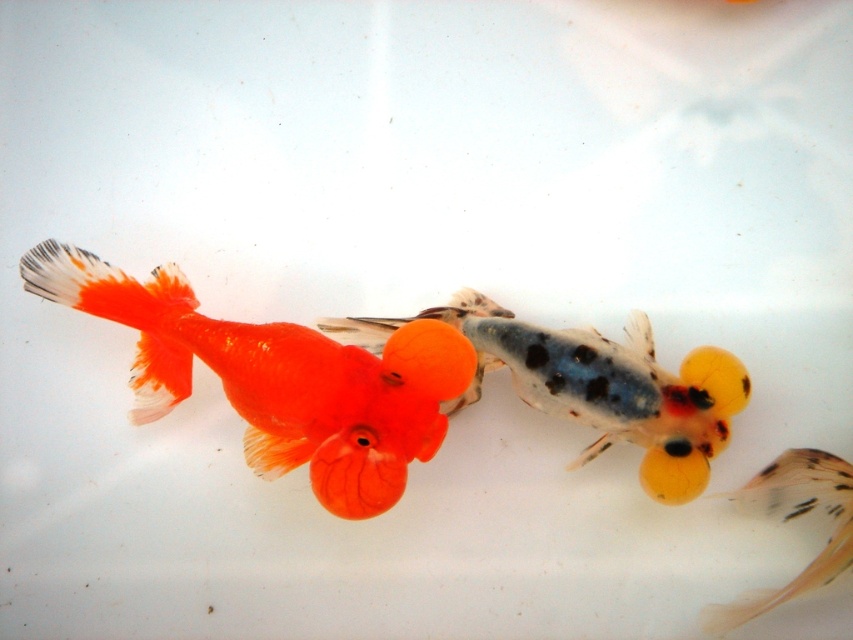
Between shiny orange goldfish at left and translucent orange goldfish at center, which one appears on the left side from the viewer's perspective?

From the viewer's perspective, shiny orange goldfish at left appears more on the left side.

Between shiny orange goldfish at left and translucent orange goldfish at center, which one appears on the right side from the viewer's perspective?

Positioned to the right is translucent orange goldfish at center.

Does point (160, 372) lie in front of point (549, 403)?

No.

Identify the location of shiny orange goldfish at left. (276, 378).

Who is positioned more to the left, shiny orange goldfish at left or translucent orange fish at lower right?

Positioned to the left is shiny orange goldfish at left.

Based on the photo, does shiny orange goldfish at left have a greater height compared to translucent orange fish at lower right?

Yes.

Describe the element at coordinates (276, 378) in the screenshot. I see `shiny orange goldfish at left` at that location.

At what (x,y) coordinates should I click in order to perform the action: click on shiny orange goldfish at left. Please return your answer as a coordinate pair (x, y). Looking at the image, I should click on (276, 378).

Is translucent orange goldfish at center further to the viewer compared to translucent orange fish at lower right?

Yes, translucent orange goldfish at center is behind translucent orange fish at lower right.

How distant is translucent orange goldfish at center from translucent orange fish at lower right?

translucent orange goldfish at center is 16.41 centimeters away from translucent orange fish at lower right.

This screenshot has width=853, height=640. What do you see at coordinates (595, 385) in the screenshot?
I see `translucent orange goldfish at center` at bounding box center [595, 385].

Image resolution: width=853 pixels, height=640 pixels. I want to click on translucent orange goldfish at center, so click(595, 385).